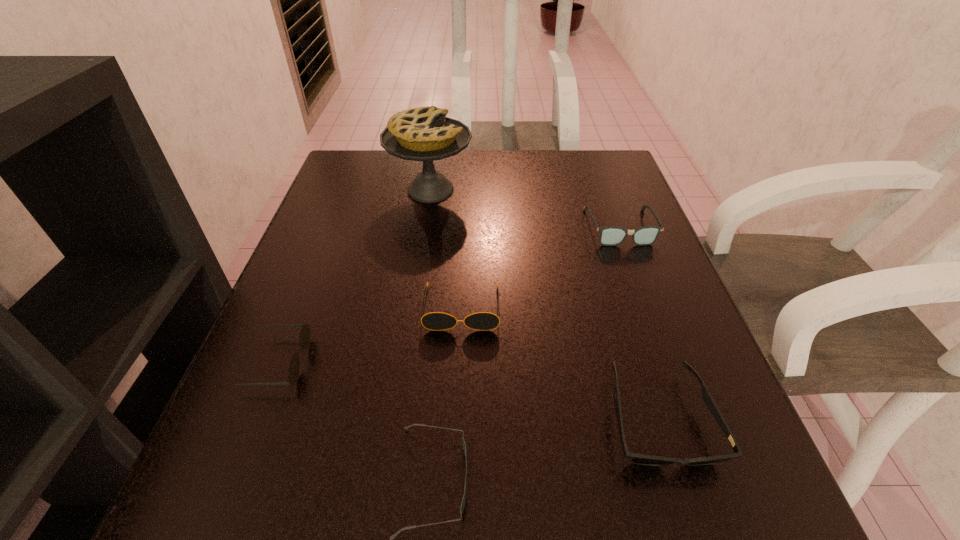
Image resolution: width=960 pixels, height=540 pixels. In the image, there is a desktop. In order to click on free space at the left edge in this screenshot , I will do `click(311, 259)`.

You are a GUI agent. You are given a task and a screenshot of the screen. Output one action in this format:
    pyautogui.click(x=<x>, y=<y>)
    Task: Click on the free region at the right edge of the desktop
    Image resolution: width=960 pixels, height=540 pixels.
    Given the screenshot: What is the action you would take?
    pyautogui.click(x=642, y=273)

Where is `vacant space at the far left corner`? vacant space at the far left corner is located at coordinates (340, 198).

The height and width of the screenshot is (540, 960). In order to click on vacant space at the far right corner of the desktop in this screenshot , I will do `click(587, 154)`.

Locate an element on the screen. This screenshot has height=540, width=960. vacant space at the near right corner of the desktop is located at coordinates (655, 511).

Where is `vacant point located between the pie and the leftmost sunglasses`? This screenshot has height=540, width=960. vacant point located between the pie and the leftmost sunglasses is located at coordinates (354, 276).

Identify the location of free space between the spectacles and the pie. This screenshot has height=540, width=960. (525, 208).

Find the location of a particular element. The height and width of the screenshot is (540, 960). free space between the spectacles and the tallest object is located at coordinates (525, 208).

Where is `free spot between the leftmost object and the pie`? free spot between the leftmost object and the pie is located at coordinates (354, 276).

Where is `free space between the spectacles and the leftmost sunglasses`? free space between the spectacles and the leftmost sunglasses is located at coordinates (449, 294).